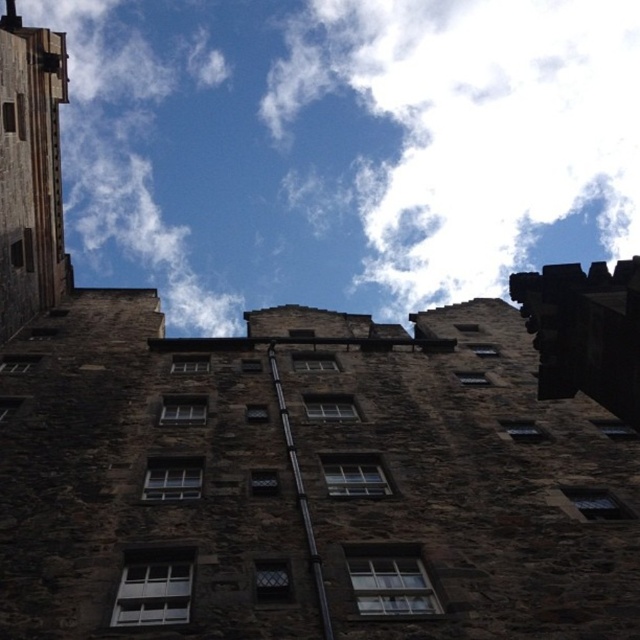
You are standing in front of the historic stone building and looking up at the sky. You notice the white fluffy cloud at upper center and the dark stone tower at left. Which object is positioned more to the east if the sun is setting in the west?

The white fluffy cloud at upper center is to the right of dark stone tower at left. Since the sun is setting in the west, the right side of the building faces east. Therefore, the white fluffy cloud at upper center is positioned more to the east compared to the dark stone tower at left.

You are an architect assessing the building facade. You notice the white fluffy cloud at upper center and the dark stone tower at left. Which one appears to occupy more horizontal space in the image?

The white fluffy cloud at upper center might be wider than dark stone tower at left.

You are an architect analyzing the building facade. You notice a point marked at coordinates (344, 147). What object does this point correspond to on the building facade?

The point at coordinates (344, 147) corresponds to the white fluffy cloud at upper center.